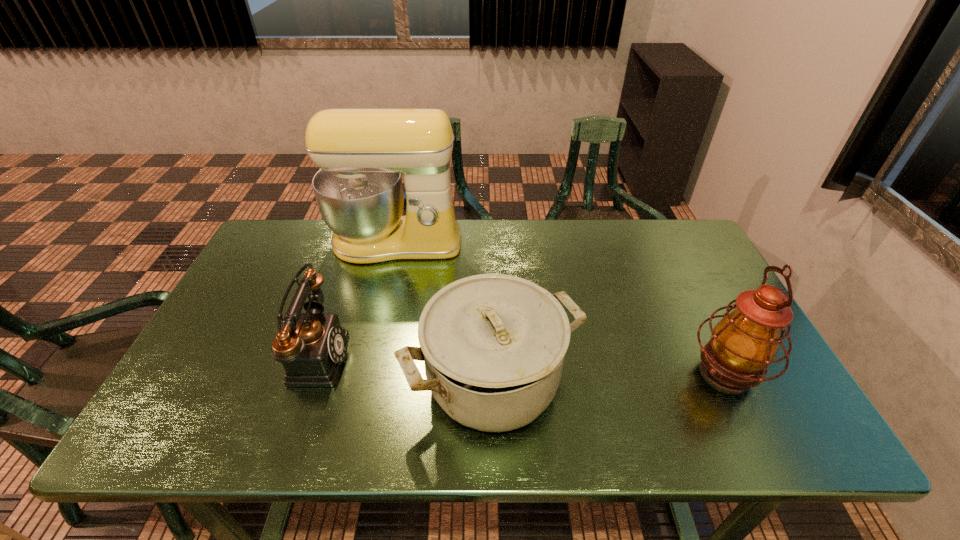
You are a GUI agent. You are given a task and a screenshot of the screen. Output one action in this format:
    pyautogui.click(x=<x>, y=<y>)
    Task: Click on the object that is at the far edge
    
    Given the screenshot: What is the action you would take?
    pyautogui.click(x=361, y=153)

Where is `object that is at the near edge`? This screenshot has width=960, height=540. object that is at the near edge is located at coordinates (494, 345).

I want to click on object that is at the right edge, so click(x=744, y=343).

Where is `vacant space at the far edge of the desktop`? This screenshot has height=540, width=960. vacant space at the far edge of the desktop is located at coordinates (471, 220).

This screenshot has height=540, width=960. In the image, there is a desktop. Identify the location of free region at the near edge. (549, 437).

Where is `vacant space at the left edge of the desktop`? This screenshot has height=540, width=960. vacant space at the left edge of the desktop is located at coordinates (227, 300).

The image size is (960, 540). Find the location of `free point at the far left corner`. free point at the far left corner is located at coordinates (265, 244).

Find the location of a particular element. vacant area at the near left corner is located at coordinates (180, 410).

Image resolution: width=960 pixels, height=540 pixels. In the image, there is a desktop. Identify the location of vacant space at the far right corner. (685, 263).

What are the coordinates of `vacant area that lies between the third shortest object and the saucepan` in the screenshot? It's located at (609, 376).